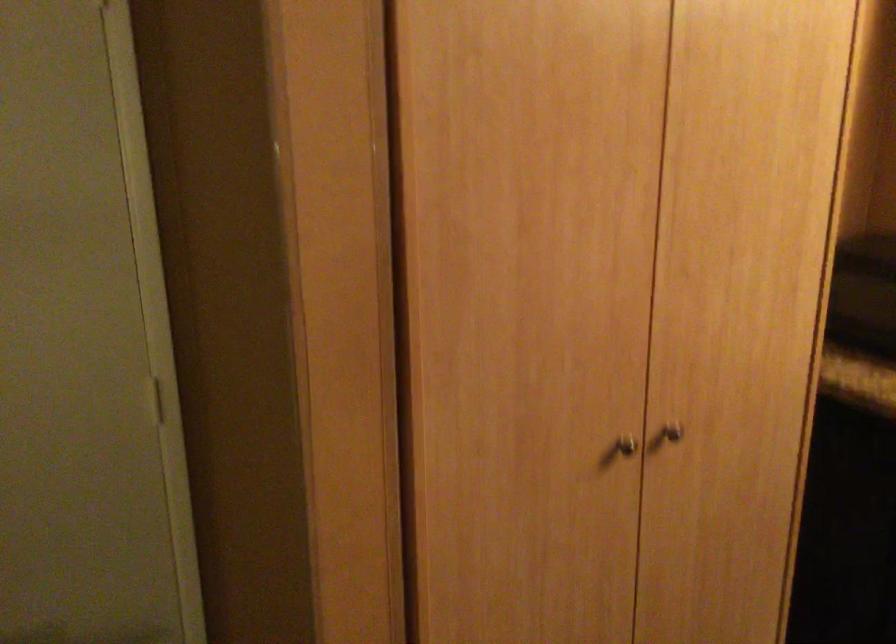
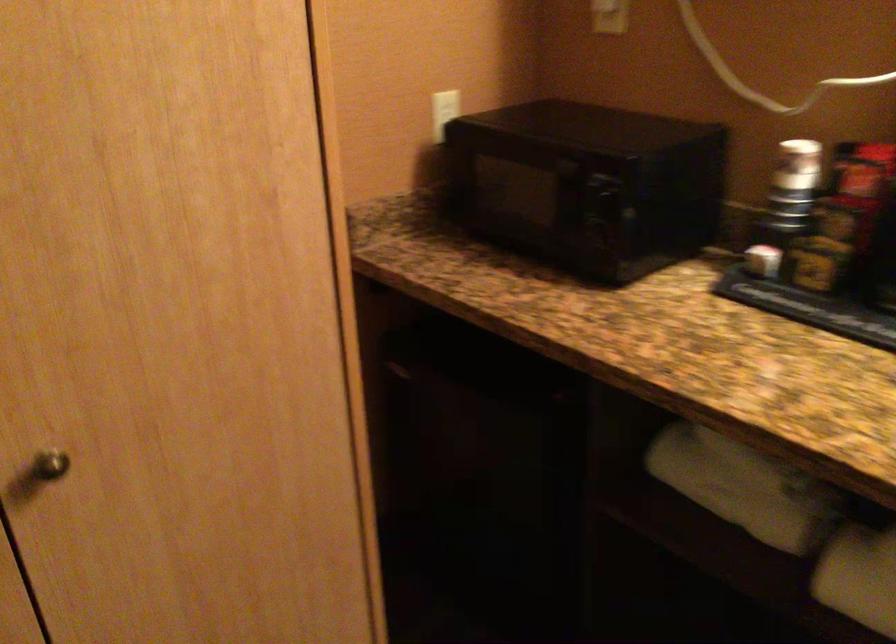
The images are taken continuously from a first-person perspective. In which direction are you moving?

The cameraman walked toward right, forward.